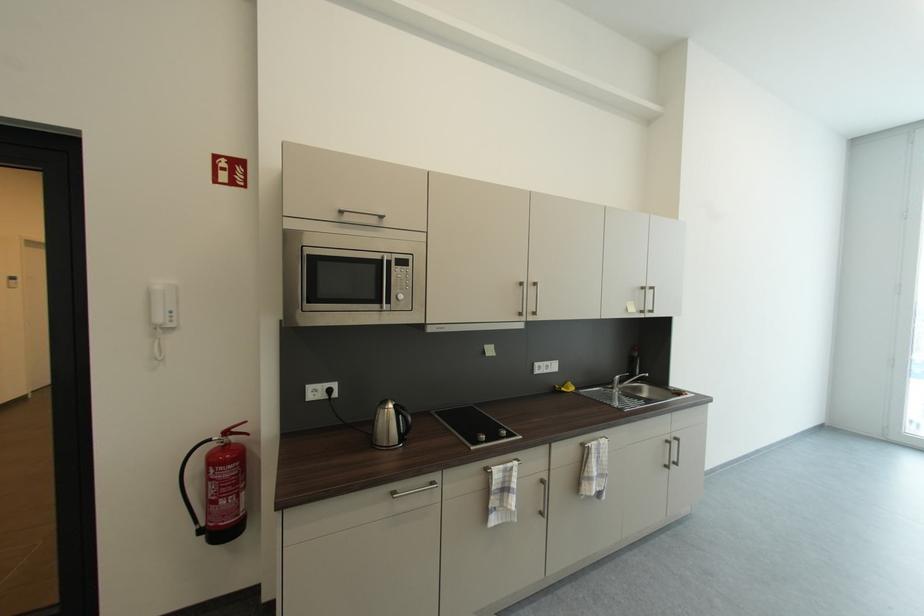
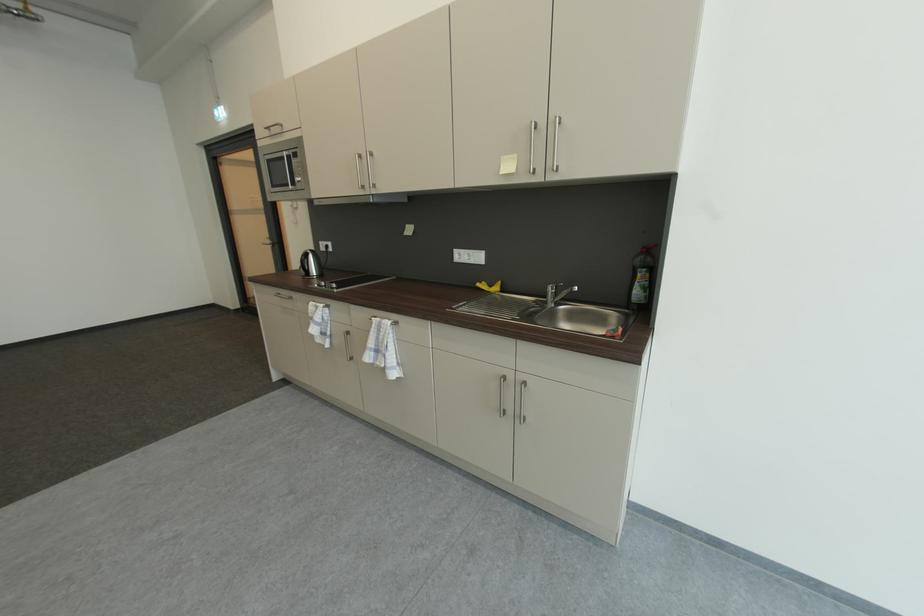
The point at (315,389) is marked in the first image. Where is the corresponding point in the second image?

(327, 245)